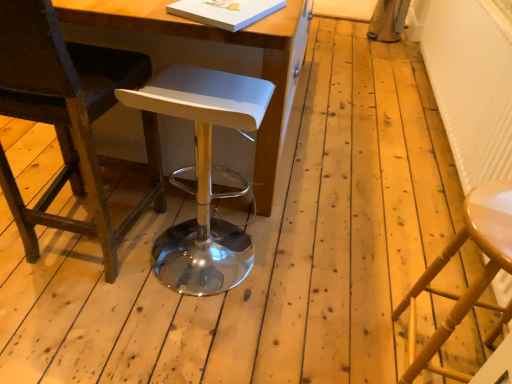
The image size is (512, 384). In order to click on free location in front of white plastic stool at center, marked as the first stool in a left-to-right arrangement in this screenshot , I will do `click(182, 336)`.